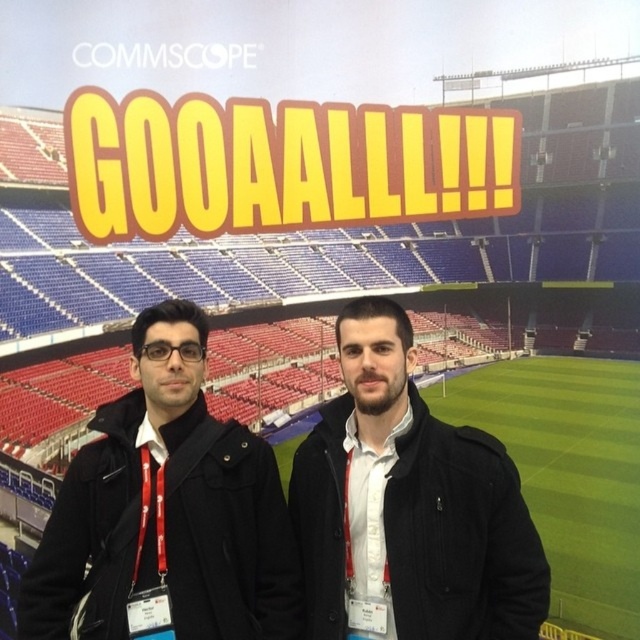
Is point (195, 417) more distant than point (356, 442)?

No, it is in front of (356, 442).

Identify the location of black matte jacket at center. (166, 509).

The width and height of the screenshot is (640, 640). I want to click on black matte jacket at center, so click(166, 509).